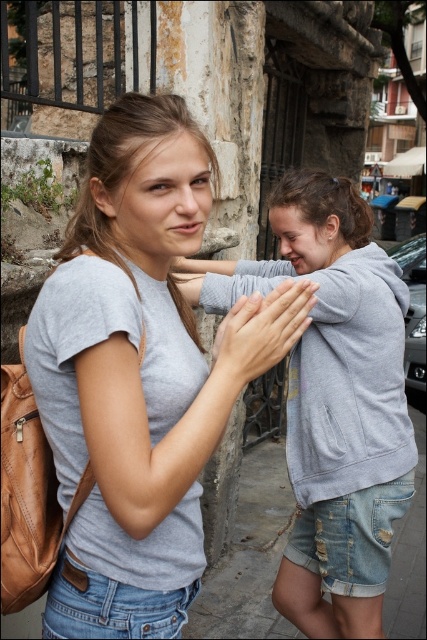
You are standing at the origin point in the image. Which direction should you move to reach the matte gray hoodie at center?

The matte gray hoodie at center is located at point 0.627 in the x direction and 0.780 in the y direction, so you should move to the right and forward to reach it.